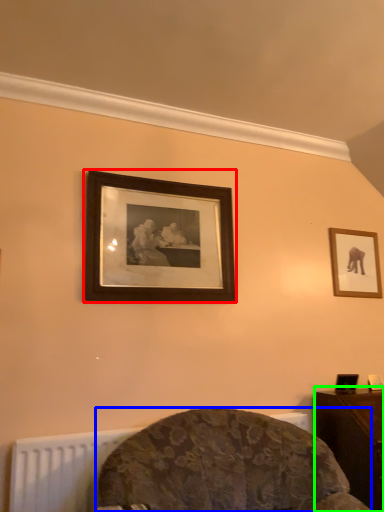
Question: Estimate the real-world distances between objects in this image. Which object is closer to picture frame (highlighted by a red box), furniture (highlighted by a blue box) or table (highlighted by a green box)?

Choices:
 (A) furniture
 (B) table

Answer: (A)